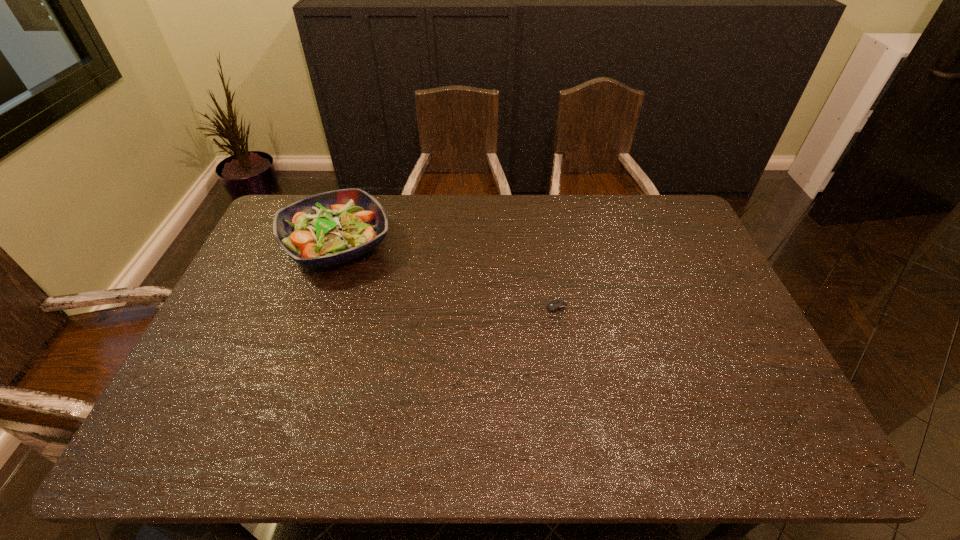
In the image, there is a desktop. Identify the location of free space at the near edge. (546, 429).

Where is `vacant space at the left edge`? Image resolution: width=960 pixels, height=540 pixels. vacant space at the left edge is located at coordinates (265, 287).

The height and width of the screenshot is (540, 960). In the image, there is a desktop. Identify the location of vacant space at the right edge. (706, 296).

Locate an element on the screen. The image size is (960, 540). vacant space at the near right corner of the desktop is located at coordinates (811, 454).

Locate an element on the screen. blank space that satisfies the following two spatial constraints: 1. on the front side of the left object; 2. on the left side of the nearer object is located at coordinates (313, 315).

Where is `vacant position in the image that satisfies the following two spatial constraints: 1. on the front side of the computer mouse; 2. on the right side of the taller object`? The height and width of the screenshot is (540, 960). vacant position in the image that satisfies the following two spatial constraints: 1. on the front side of the computer mouse; 2. on the right side of the taller object is located at coordinates (313, 315).

Identify the location of free space that satisfies the following two spatial constraints: 1. on the front side of the salad plate; 2. on the right side of the shorter object. Image resolution: width=960 pixels, height=540 pixels. (313, 315).

Identify the location of free space that satisfies the following two spatial constraints: 1. on the front side of the left object; 2. on the left side of the shorter object. This screenshot has width=960, height=540. (313, 315).

Identify the location of free space that satisfies the following two spatial constraints: 1. on the front side of the salad plate; 2. on the right side of the computer mouse. The height and width of the screenshot is (540, 960). (313, 315).

You are a GUI agent. You are given a task and a screenshot of the screen. Output one action in this format:
    pyautogui.click(x=<x>, y=<y>)
    Task: Click on the vacant space that satisfies the following two spatial constraints: 1. on the front side of the farther object; 2. on the left side of the shorter object
    The width and height of the screenshot is (960, 540).
    Given the screenshot: What is the action you would take?
    pyautogui.click(x=313, y=315)